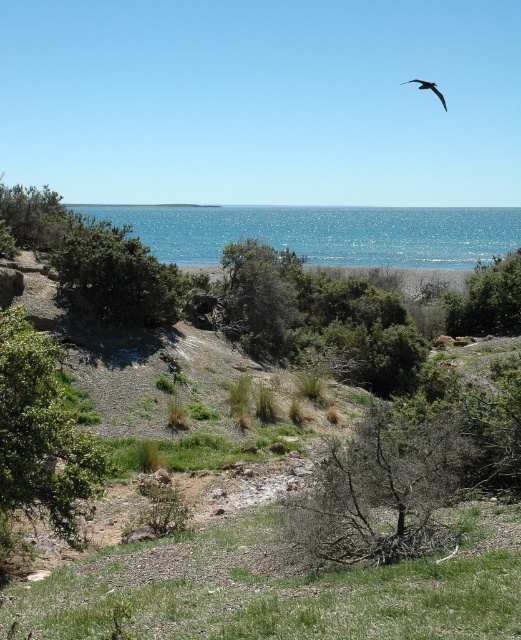
In the scene shown: You are standing on the beach and see the green leafy tree at center and the dark gray feathered bird at upper right. Which object is positioned more to the east?

The dark gray feathered bird at upper right is positioned more to the east because the green leafy tree at center is to the left of it, and left typically corresponds to the east direction when facing north in standard map orientation.